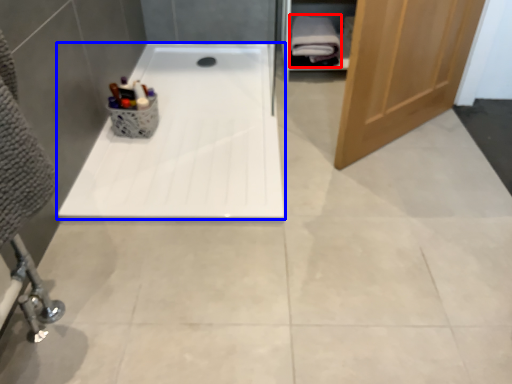
Question: Which of the following is the closest to the observer, bath towel (highlighted by a red box) or bathtub (highlighted by a blue box)?

Choices:
 (A) bath towel
 (B) bathtub

Answer: (B)